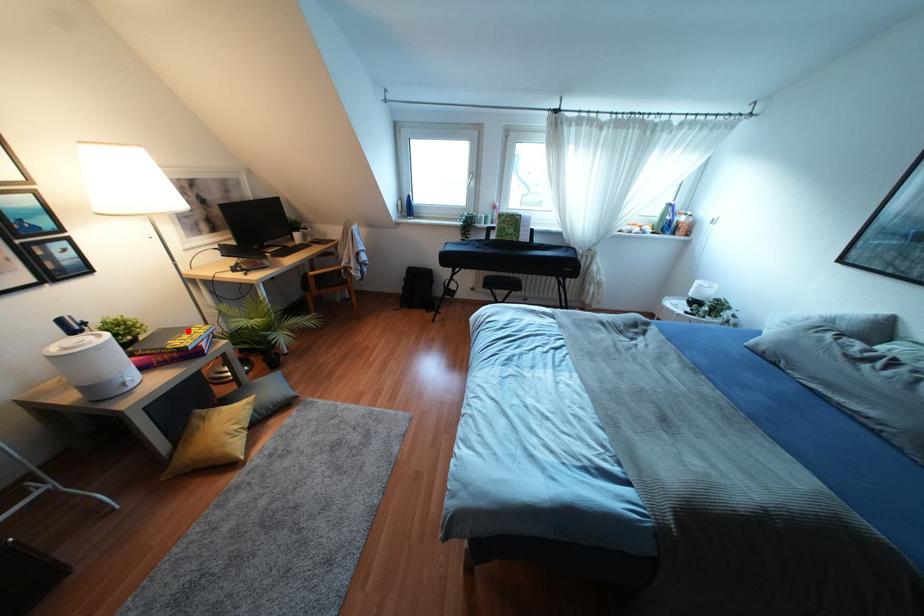
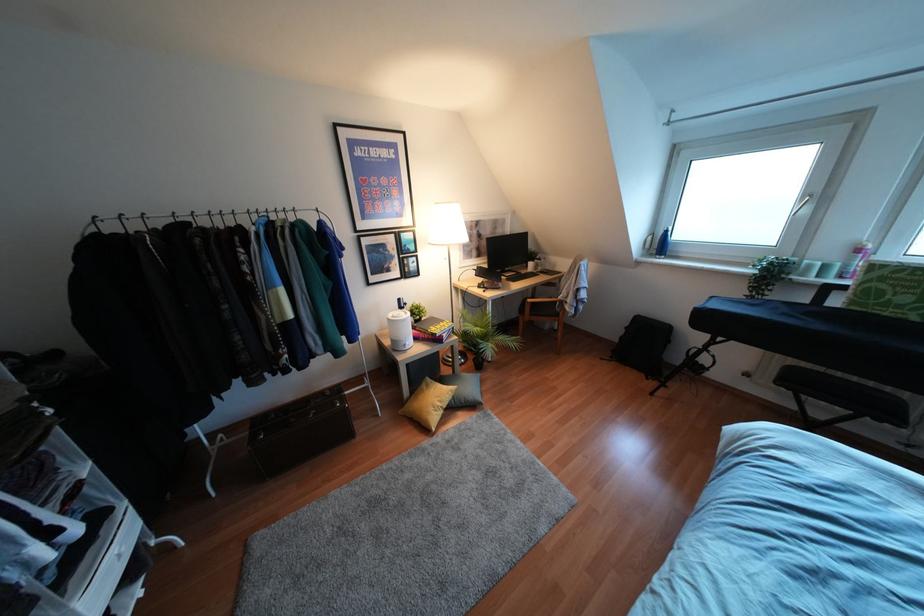
Find the pixel in the second image that matches the highlighted location in the first image.

(441, 323)